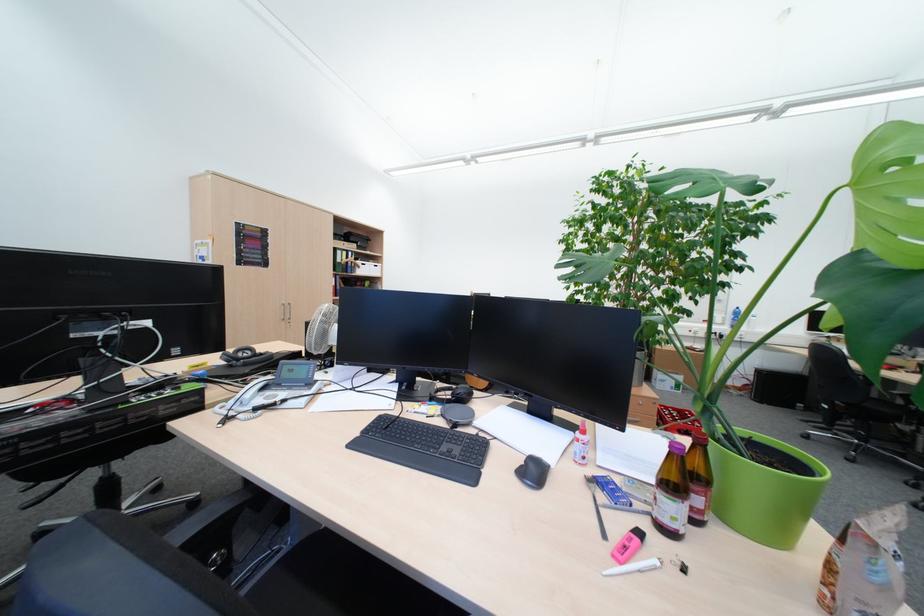
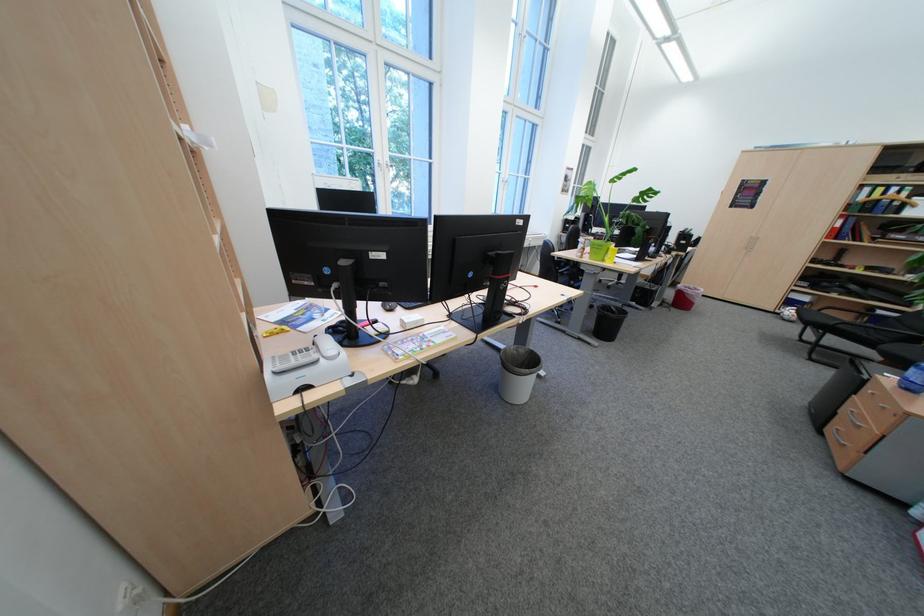
In the second image, find the point that corresponds to (x=346, y=251) in the first image.

(873, 188)